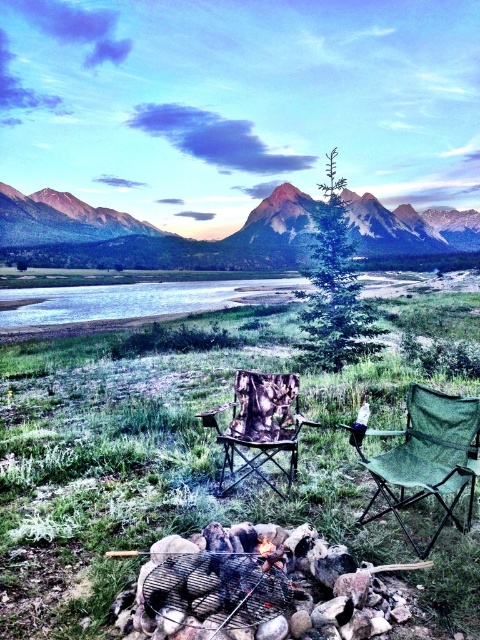
In the scene shown: You are a hiker who wants to take a photo of the rugged granite mountain at upper center and the camo fabric chair at center. From your current position, which object is higher in the frame?

The rugged granite mountain at upper center is higher in the frame than the camo fabric chair at center because it is positioned over it.